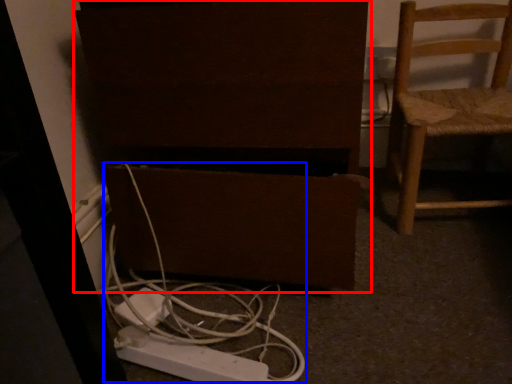
Question: Among these objects, which one is nearest to the camera, furniture (highlighted by a red box) or cable (highlighted by a blue box)?

Choices:
 (A) furniture
 (B) cable

Answer: (A)